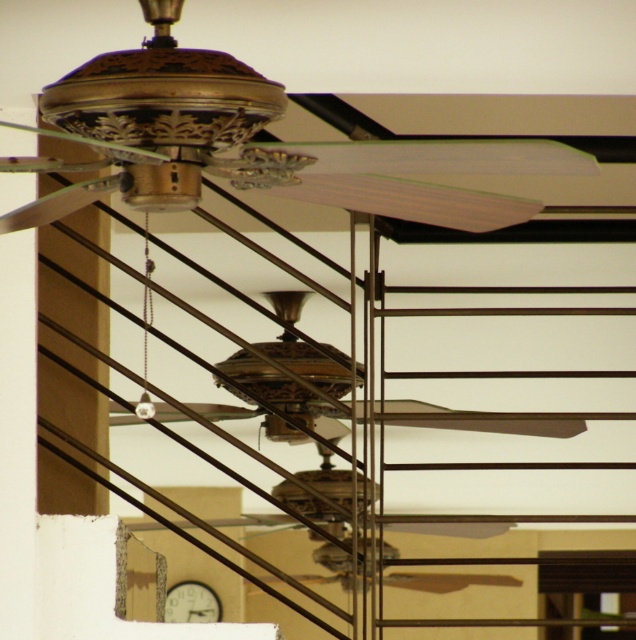
Consider the image. You are standing in a room and want to adjust the gold metallic fan at upper center using a 2.5 meter long ladder. Can you safely reach the fan with the ladder?

The gold metallic fan at upper center and the camera are 3.11 meters apart. Since the ladder is only 2.5 meters long, it is not long enough to safely reach the fan.

You are standing in a room with the gold metallic fan at center and the white wooden clock at lower center. If you want to reach the fan, which direction should you move from the clock?

The gold metallic fan at center is 8.65 meters away from the white wooden clock at lower center. Since the clock is at lower center, moving upward or forward from the clock would lead towards the fan.

Based on the photo, you are an interior designer planning to install a new light fixture between the gold metallic fan at center and the white wooden clock at lower center. Which object should the light fixture be placed above to ensure it is not too close to the ceiling?

The light fixture should be placed above the white wooden clock at lower center because the gold metallic fan at center is much taller, so placing it above the shorter object would avoid being too close to the ceiling.